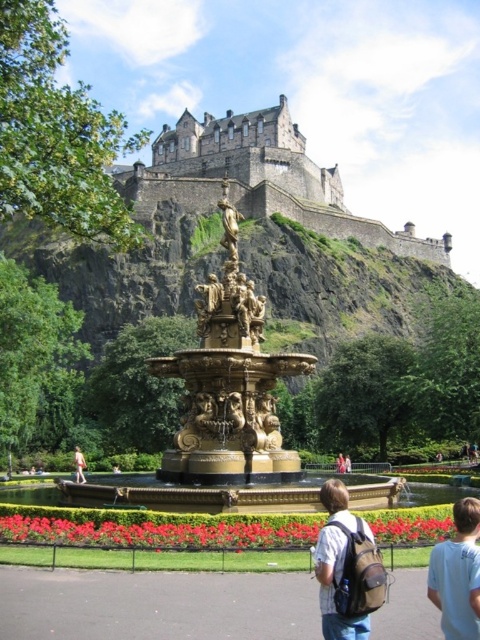
Question: Which object is positioned closest to the light blue denim jeans at center?

Choices:
 (A) light brown wooden bench at center
 (B) brown stone castle at upper center
 (C) gold metallic fountain at center

Answer: (A)

Question: Where is light brown backpack at lower center located in relation to light brown wooden bench at center in the image?

Choices:
 (A) above
 (B) below

Answer: (A)

Question: Which point is closer to the camera?

Choices:
 (A) [74, 445]
 (B) [429, 573]

Answer: (B)

Question: Which of the following is the farthest from the observer?

Choices:
 (A) gold metallic fountain at center
 (B) white cotton shirt at lower right

Answer: (A)

Question: Is brown stone castle at upper center behind light brown wooden bench at center?

Choices:
 (A) yes
 (B) no

Answer: (A)

Question: Is light brown backpack at lower center positioned behind white cotton shirt at lower right?

Choices:
 (A) yes
 (B) no

Answer: (A)